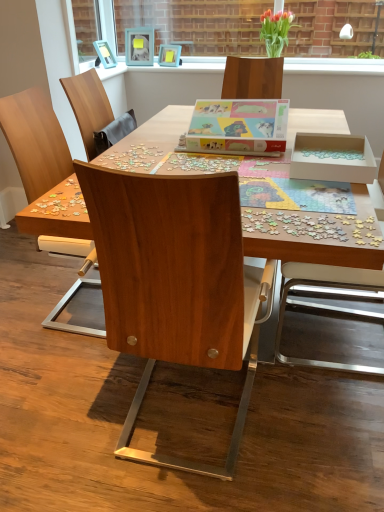
Find the location of `vacant space in front of wooden chair at center, marked as the 1th chair in a left-to-right arrangement`. vacant space in front of wooden chair at center, marked as the 1th chair in a left-to-right arrangement is located at coordinates (70, 373).